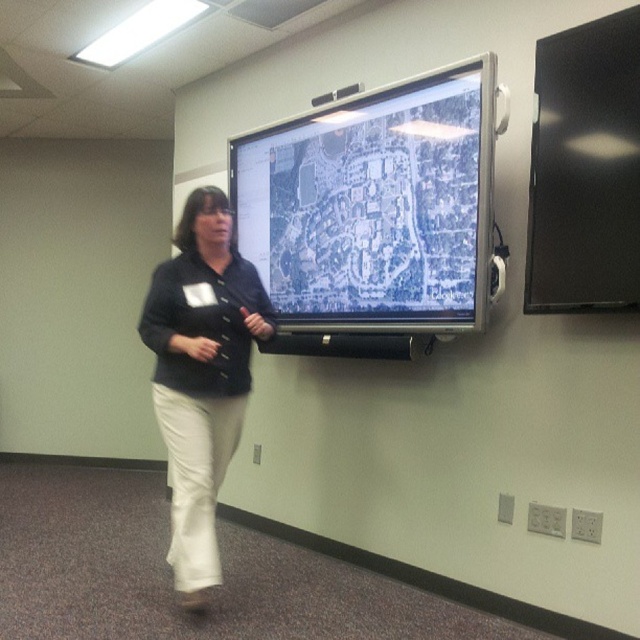
You are a camera operator adjusting the focus for the presentation. The presenter is moving towards the projection screen. There are two points marked in the scene, point (618, 289) and point (156, 307). Which point should you focus on first to ensure the presenter stays in focus as they move towards the screen?

Point (618, 289) is closer to the camera than point (156, 307), so you should focus on point (618, 289) first to ensure the presenter stays in focus as they move towards the screen.

You are setting up a presentation and need to decide where to place your laptop. The white matte projection screen at upper center and the black glossy screen at upper right are both available. Which screen has a greater height to accommodate a larger presentation slide?

The white matte projection screen at upper center is much taller than the black glossy screen at upper right, so it can accommodate a larger presentation slide.

You are an attendee at a presentation and notice the white matte projection screen at upper center and the matte black shirt at center. Which object is shorter in height?

The white matte projection screen at upper center is shorter in height than the matte black shirt at center.